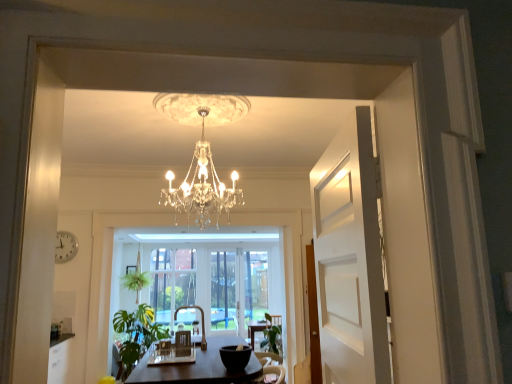
This screenshot has width=512, height=384. Describe the element at coordinates (349, 258) in the screenshot. I see `white wooden door at right` at that location.

This screenshot has width=512, height=384. What do you see at coordinates (164, 348) in the screenshot?
I see `brown leather armchair at center, marked as the second armchair in a front-to-back arrangement` at bounding box center [164, 348].

You are a GUI agent. You are given a task and a screenshot of the screen. Output one action in this format:
    pyautogui.click(x=<x>, y=<y>)
    Task: Click on the matte black armchair at center, which is the 3th armchair in back-to-front order
    
    Given the screenshot: What is the action you would take?
    pyautogui.click(x=183, y=343)

Describe the element at coordinates (272, 335) in the screenshot. The height and width of the screenshot is (384, 512). I see `green leafy plant at lower center, acting as the 2th plant starting from the left` at that location.

The width and height of the screenshot is (512, 384). I want to click on white wooden door at right, so click(x=349, y=258).

Is green leafy plant at lower left located within green leafy plant at lower center, which is the first plant in front-to-back order?

Definitely not — green leafy plant at lower left is not inside green leafy plant at lower center, which is the first plant in front-to-back order.

Can you confirm if green leafy plant at lower center, acting as the 2th plant starting from the left, is thinner than green leafy plant at lower left?

Correct, the width of green leafy plant at lower center, acting as the 2th plant starting from the left, is less than that of green leafy plant at lower left.

Is green leafy plant at lower left at the back of green leafy plant at lower center, which appears as the 2th plant when viewed from the back?

No.

Is green leafy plant at lower center, acting as the 2th plant starting from the left, smaller than green leafy plant at lower left?

Yes.

Is white plastic clock at left facing towards brown leather armchair at center, the 2th armchair positioned from the back?

No, white plastic clock at left does not turn towards brown leather armchair at center, the 2th armchair positioned from the back.

Is brown leather armchair at center, marked as the second armchair in a front-to-back arrangement, a part of white plastic clock at left?

No, brown leather armchair at center, marked as the second armchair in a front-to-back arrangement, is not surrounded by white plastic clock at left.

Between white plastic clock at left and brown leather armchair at center, the 2th armchair positioned from the back, which one is positioned behind?

white plastic clock at left is further from the camera.

Can you confirm if white plastic clock at left is positioned to the left of brown leather armchair at center, the 2th armchair positioned from the back?

Yes.

Is dark wood table at center bigger than clear glass window screen at center, which is counted as the first window screen, starting from the right?

Yes, dark wood table at center is bigger than clear glass window screen at center, which is counted as the first window screen, starting from the right.

Which window screen is the 1st one when counting from the left side of the dark wood table at center? Please provide its 2D coordinates.

[(223, 290)]

Is dark wood table at center far away from clear glass window screen at center, marked as the 2th window screen in a left-to-right arrangement?

That's right, there is a large distance between dark wood table at center and clear glass window screen at center, marked as the 2th window screen in a left-to-right arrangement.

Is dark wood table at center oriented away from clear glass window screen at center, which is counted as the first window screen, starting from the right?

dark wood table at center is not turned away from clear glass window screen at center, which is counted as the first window screen, starting from the right.

Which is more to the right, matte black armchair at center, the 1th armchair viewed from the front, or green leafy plant at lower left?

matte black armchair at center, the 1th armchair viewed from the front, is more to the right.

Is green leafy plant at lower left inside matte black armchair at center, the 1th armchair viewed from the front?

Actually, green leafy plant at lower left is outside matte black armchair at center, the 1th armchair viewed from the front.

Between matte black armchair at center, which is the 3th armchair in back-to-front order, and green leafy plant at lower left, which one has smaller width?

matte black armchair at center, which is the 3th armchair in back-to-front order.

Can you confirm if matte black armchair at center, the 1th armchair viewed from the front, is taller than green leafy plant at lower left?

No.

What's the angular difference between white wooden door at right and white plastic clock at left's facing directions?

95.3 degrees separate the facing orientations of white wooden door at right and white plastic clock at left.

Is white wooden door at right not close to white plastic clock at left?

white wooden door at right is positioned a significant distance from white plastic clock at left.

Consider the image. Is white wooden door at right aimed at white plastic clock at left?

No, white wooden door at right is not turned towards white plastic clock at left.

Does white wooden door at right appear on the right side of white plastic clock at left?

Correct, you'll find white wooden door at right to the right of white plastic clock at left.

Between clear glass window screen at center, which appears as the second window screen when viewed from the right, and white plastic clock at left, which one has more height?

With more height is clear glass window screen at center, which appears as the second window screen when viewed from the right.

Identify the location of the 1st window screen below the white plastic clock at left (from the image's perspective). (172, 281).

Does point (189, 262) lie behind point (73, 238)?

Yes.

How different are the orientations of wooden armchair at center, the third armchair positioned from the front, and matte black armchair at center, the 1th armchair viewed from the front, in degrees?

90 degrees separate the facing orientations of wooden armchair at center, the third armchair positioned from the front, and matte black armchair at center, the 1th armchair viewed from the front.

Considering the sizes of objects wooden armchair at center, the first armchair when ordered from back to front, and matte black armchair at center, the 1th armchair viewed from the front, in the image provided, who is wider, wooden armchair at center, the first armchair when ordered from back to front, or matte black armchair at center, the 1th armchair viewed from the front,?

wooden armchair at center, the first armchair when ordered from back to front, is wider.

Looking at this image, who is smaller, wooden armchair at center, the third armchair positioned from the front, or matte black armchair at center, the 1th armchair viewed from the front?

matte black armchair at center, the 1th armchair viewed from the front, is smaller.

From the image's perspective, is wooden armchair at center, the first armchair when ordered from back to front, on top of matte black armchair at center, which is the 3th armchair in back-to-front order?

No, from the image's perspective, wooden armchair at center, the first armchair when ordered from back to front, is not above matte black armchair at center, which is the 3th armchair in back-to-front order.

The image size is (512, 384). I want to click on plant that is below the green leafy plant at lower left (from the image's perspective), so click(x=272, y=335).

Which armchair is the 1st one when counting from the right side of the white plastic clock at left? Please provide its 2D coordinates.

[(164, 348)]

When comparing their distances from green leafy plant at lower left, does brown leather armchair at center, marked as the second armchair in a front-to-back arrangement, or dark wood table at center seem closer?

dark wood table at center.

Looking at the image, which one is located further to green leafy plant at lower left, green leafy plant at center, the first plant from the left, or clear glass window screen at center, which is counted as the first window screen, starting from the right?

clear glass window screen at center, which is counted as the first window screen, starting from the right, lies further to green leafy plant at lower left than the other object.

Considering their positions, is green leafy plant at lower center, which is the first plant in front-to-back order, positioned closer to green leafy plant at lower left than dark wood table at center?

dark wood table at center is positioned closer to the anchor green leafy plant at lower left.

When comparing their distances from white plastic clock at left, does clear glass window screen at center, which is counted as the first window screen, starting from the right, or green leafy plant at lower center, acting as the 2th plant starting from the left, seem further?

Based on the image, green leafy plant at lower center, acting as the 2th plant starting from the left, appears to be further to white plastic clock at left.

Based on their spatial positions, is green leafy plant at center, placed as the second plant when sorted from right to left, or brown leather armchair at center, the 2th armchair positioned from the back, closer to white plastic clock at left?

green leafy plant at center, placed as the second plant when sorted from right to left, is positioned closer to the anchor white plastic clock at left.

From the image, which object appears to be nearer to green leafy plant at lower center, acting as the 2th plant starting from the left, clear glass window screen at center, which appears as the second window screen when viewed from the right, or dark wood table at center?

dark wood table at center is positioned closer to the anchor green leafy plant at lower center, acting as the 2th plant starting from the left.

Consider the image. When comparing their distances from green leafy plant at lower center, which is the first plant in front-to-back order, does dark wood table at center or white wooden door at right seem further?

white wooden door at right is further to green leafy plant at lower center, which is the first plant in front-to-back order.

Considering their positions, is green leafy plant at lower center, acting as the 2th plant starting from the left, positioned further to brown leather armchair at center, the 2th armchair positioned from the back, than matte black armchair at center, the 1th armchair viewed from the front?

green leafy plant at lower center, acting as the 2th plant starting from the left.

The height and width of the screenshot is (384, 512). What are the coordinates of `houseplant between white wooden door at right and green leafy plant at lower center, which appears as the 2th plant when viewed from the back, from front to back` in the screenshot? It's located at (137, 334).

You are a GUI agent. You are given a task and a screenshot of the screen. Output one action in this format:
    pyautogui.click(x=<x>, y=<y>)
    Task: Click on the houseplant between dark wood table at center and clear glass window screen at center, which appears as the second window screen when viewed from the right, in the front-back direction
    
    Given the screenshot: What is the action you would take?
    pyautogui.click(x=137, y=334)

The image size is (512, 384). Find the location of `table between white wooden door at right and green leafy plant at lower left in the front-back direction`. table between white wooden door at right and green leafy plant at lower left in the front-back direction is located at coordinates (197, 367).

Find the location of a particular element. table located between white wooden door at right and clear glass window screen at center, placed as the 1th window screen when sorted from left to right, in the depth direction is located at coordinates (197, 367).